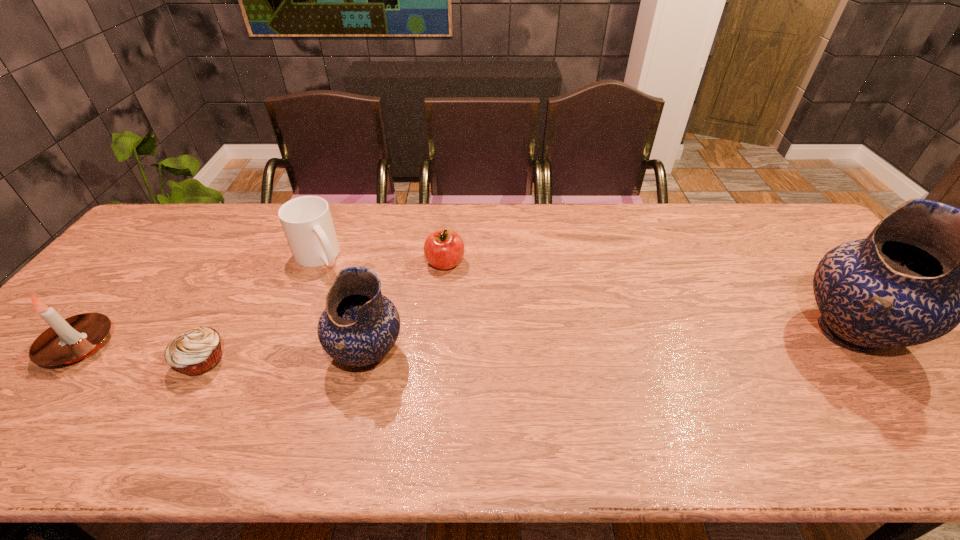
Locate an element on the screen. This screenshot has height=540, width=960. object that is at the right edge is located at coordinates (927, 266).

You are a GUI agent. You are given a task and a screenshot of the screen. Output one action in this format:
    pyautogui.click(x=<x>, y=<y>)
    Task: Click on the vacant point at the far edge
    
    Given the screenshot: What is the action you would take?
    pyautogui.click(x=706, y=228)

Locate an element on the screen. The height and width of the screenshot is (540, 960). free region at the near edge of the desktop is located at coordinates (157, 394).

Image resolution: width=960 pixels, height=540 pixels. Find the location of `free space at the right edge of the desktop`. free space at the right edge of the desktop is located at coordinates (804, 280).

The image size is (960, 540). I want to click on free space at the far right corner of the desktop, so click(769, 228).

Find the location of a particular element. free spot between the fourth object from right to left and the muffin is located at coordinates click(261, 309).

Where is `free space between the apple and the rightmost object`? free space between the apple and the rightmost object is located at coordinates (647, 298).

The width and height of the screenshot is (960, 540). What are the coordinates of `free space between the shorter pottery and the apple` in the screenshot? It's located at (406, 308).

Locate an element on the screen. The width and height of the screenshot is (960, 540). free area in between the right pottery and the fifth tallest object is located at coordinates (647, 298).

Identify the location of unoccupied area between the mug and the leftmost object. The width and height of the screenshot is (960, 540). (199, 301).